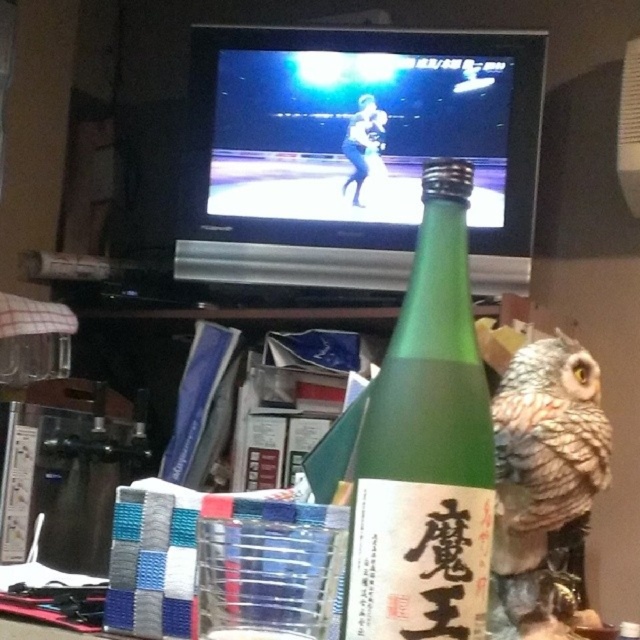
Between green glass bottle at center and brown speckled owl at right, which one has more height?

Standing taller between the two is green glass bottle at center.

The height and width of the screenshot is (640, 640). Find the location of `green glass bottle at center`. green glass bottle at center is located at coordinates (426, 449).

Where is `green glass bottle at center`? Image resolution: width=640 pixels, height=640 pixels. green glass bottle at center is located at coordinates (426, 449).